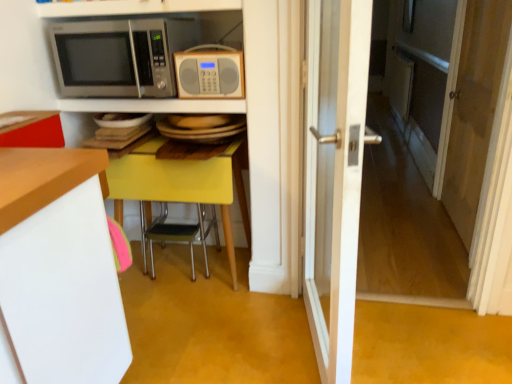
This screenshot has width=512, height=384. I want to click on vacant region in front of yellow glossy table at center, so click(x=185, y=327).